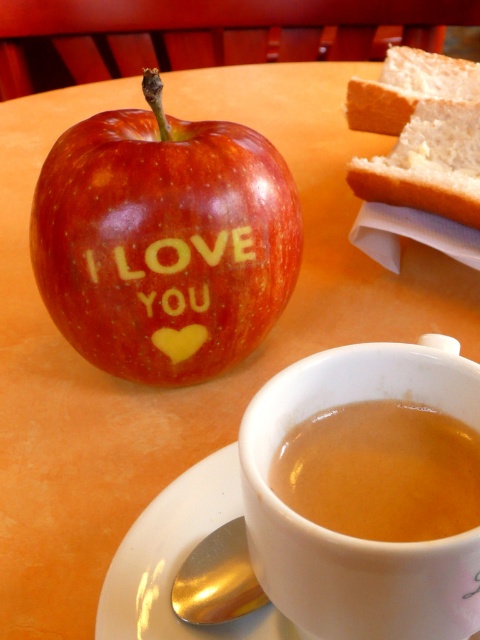
Is white soft bread at upper right positioned in front of gold embossed text at center?

That is False.

Does white soft bread at upper right have a greater width compared to gold embossed text at center?

Yes.

Is point (404, 145) closer to camera compared to point (147, 268)?

No.

You are a GUI agent. You are given a task and a screenshot of the screen. Output one action in this format:
    pyautogui.click(x=<x>, y=<y>)
    Task: Click on the white soft bread at upper right
    
    Given the screenshot: What is the action you would take?
    pyautogui.click(x=429, y=163)

The height and width of the screenshot is (640, 480). What do you see at coordinates (382, 472) in the screenshot? I see `brown matte coffee cup at lower center` at bounding box center [382, 472].

Does brown matte coffee cup at lower center have a greater width compared to gold embossed text at center?

In fact, brown matte coffee cup at lower center might be narrower than gold embossed text at center.

Is point (391, 500) positioned behind point (205, 282)?

That is False.

Find the location of a particular element. Image resolution: width=480 pixels, height=640 pixels. brown matte coffee cup at lower center is located at coordinates (382, 472).

Measure the distance between point (216, 474) and camera.

Point (216, 474) is 60.60 centimeters from camera.

Who is positioned more to the right, white ceramic saucer at lower center or gold embossed text at center?

Positioned to the right is white ceramic saucer at lower center.

Does point (229, 467) come closer to viewer compared to point (180, 308)?

Yes, point (229, 467) is in front of point (180, 308).

At what (x,y) coordinates should I click in order to perform the action: click on white ceramic saucer at lower center. Please return your answer as a coordinate pair (x, y). The image size is (480, 640). Looking at the image, I should click on (178, 561).